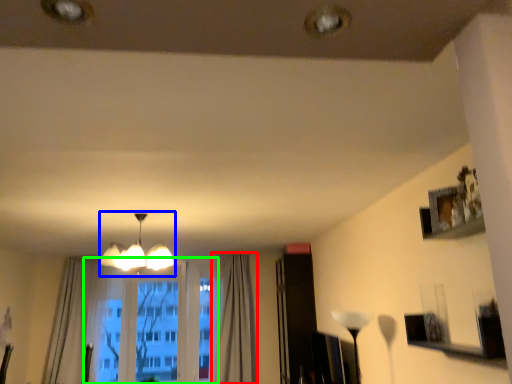
Question: Estimate the real-world distances between objects in this image. Which object is farther from curtain (highlighted by a red box), lamp (highlighted by a blue box) or bay window (highlighted by a green box)?

Choices:
 (A) lamp
 (B) bay window

Answer: (A)